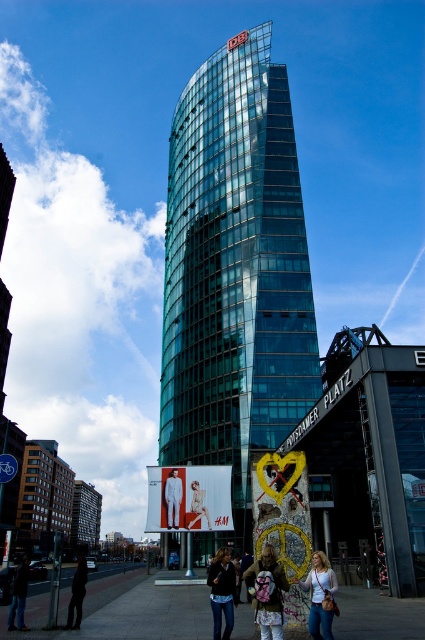
Which is below, white cotton backpack at center or metallic pole at center?

metallic pole at center

Can you confirm if white cotton backpack at center is positioned above metallic pole at center?

Yes, white cotton backpack at center is above metallic pole at center.

Does point (274, 618) come behind point (187, 547)?

That is False.

This screenshot has height=640, width=425. What are the coordinates of `white cotton backpack at center` in the screenshot? It's located at (266, 593).

Between white fabric sign at lower center and dark blue jeans at lower left, which one is positioned higher?

white fabric sign at lower center is higher up.

Does white fabric sign at lower center have a greater width compared to dark blue jeans at lower left?

Indeed, white fabric sign at lower center has a greater width compared to dark blue jeans at lower left.

I want to click on white fabric sign at lower center, so click(189, 499).

This screenshot has height=640, width=425. What are the coordinates of `white fabric sign at lower center` in the screenshot? It's located at click(x=189, y=499).

Between point (172, 380) and point (193, 509), which one is positioned in front?

Point (193, 509) is more forward.

This screenshot has height=640, width=425. In order to click on transparent glass tower at center in this screenshot , I will do `click(235, 272)`.

Image resolution: width=425 pixels, height=640 pixels. What are the coordinates of `transparent glass tower at center` in the screenshot? It's located at (235, 272).